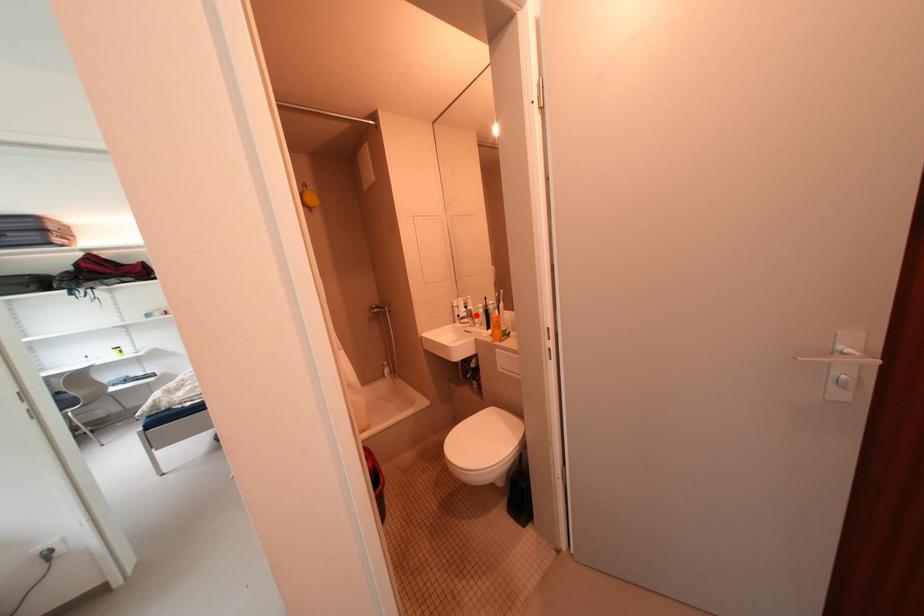
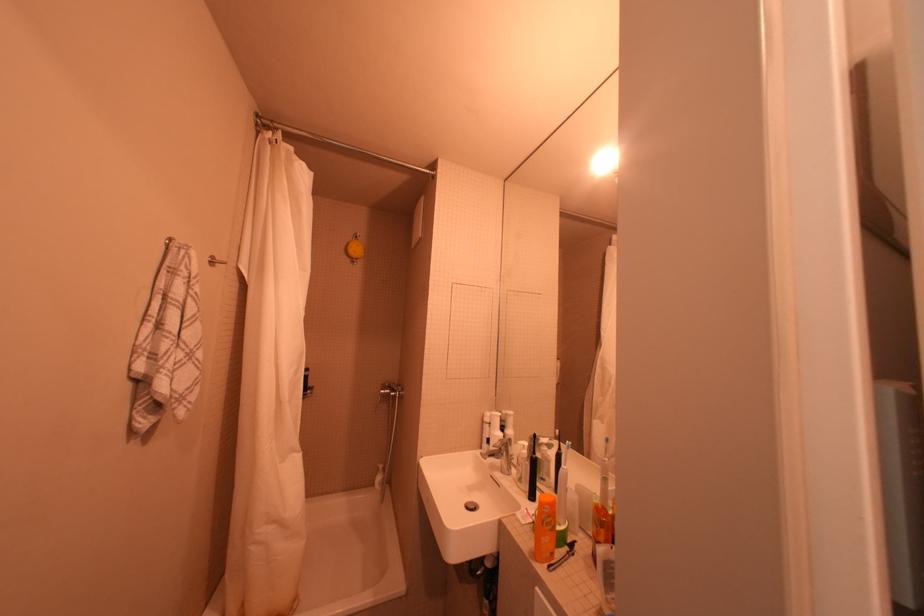
Locate, in the second image, the point that corresponds to the highlighted location in the first image.

(508, 450)